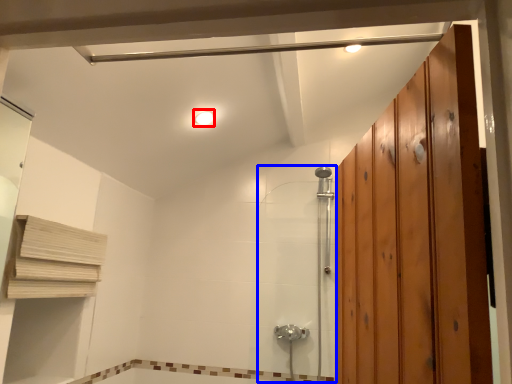
Question: Which object is closer to the camera taking this photo, light fixture (highlighted by a red box) or shower door (highlighted by a blue box)?

Choices:
 (A) light fixture
 (B) shower door

Answer: (A)